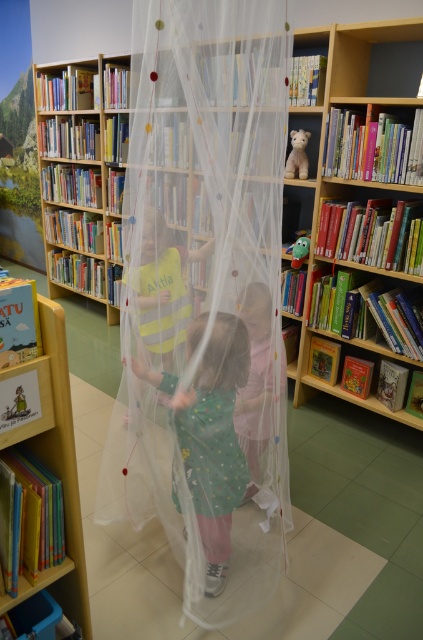
You are a librarian who needs to place a new book that is 1.5 inches thick. You have to choose between the wooden bookshelf at right and the transparent plastic bookcase at center. Which one can accommodate the book?

The wooden bookshelf at right and transparent plastic bookcase at center are 1.22 inches apart from each other. Since the book is 1.5 inches thick, neither can accommodate it because the space between them is smaller than the book.